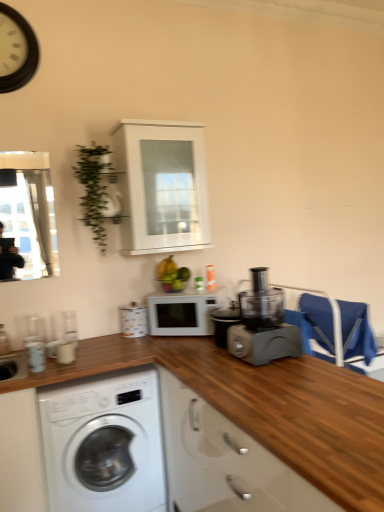
The width and height of the screenshot is (384, 512). Identify the location of vacant area that is situated to the right of white glossy cup at lower left, marked as the 2th appliance in a right-to-left arrangement. (92, 360).